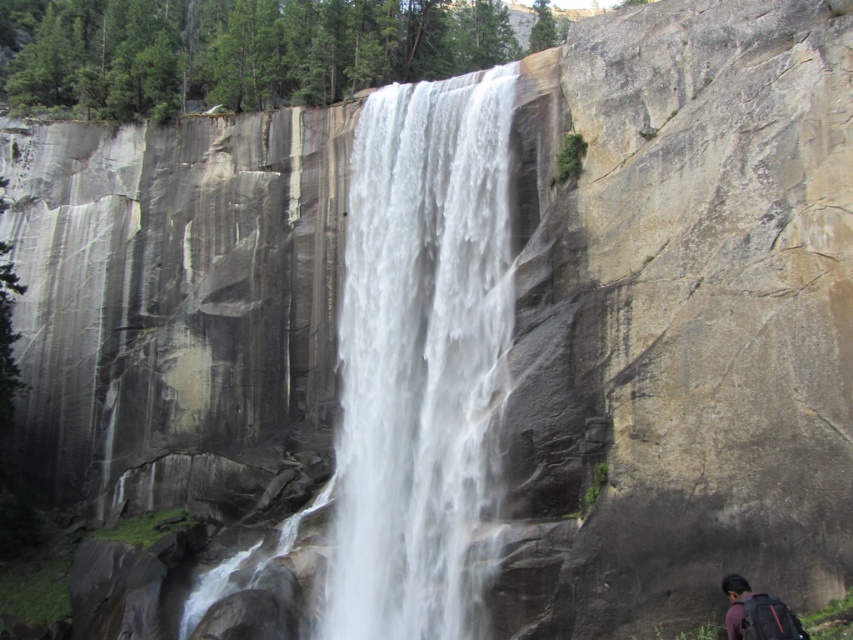
You are standing at the base of the waterfall and want to retrieve your dark gray backpack at lower right without getting wet. The white smooth waterfall at center is spraying water in all directions. Can you safely reach the backpack?

The white smooth waterfall at center is 37.35 meters away from the dark gray backpack at lower right. Since the waterfall is spraying water in all directions, but the distance between them is quite large, it might be possible to reach the backpack without getting wet by moving carefully around the spray area. However, caution is advised due to the powerful water spray from the waterfall.

You are a hiker who wants to take a photo of the white smooth waterfall at center without any obstructions. However, there is a dark gray backpack at lower right in your view. Can you move the backpack to capture an unobstructed view of the waterfall?

The dark gray backpack at lower right is behind the white smooth waterfall at center, so moving it won not obstruct the view of the waterfall since it is already positioned behind it.

You are standing at the base of the waterfall and want to reach the point marked as point (418, 141). Given that the average walking distance for a person is 1.5 meters per second, how many seconds will it take you to reach that point?

The point (418, 141) is 72.32 meters away from the viewer. At an average walking speed of 1.5 meters per second, it would take approximately 48.21 seconds to reach the point.